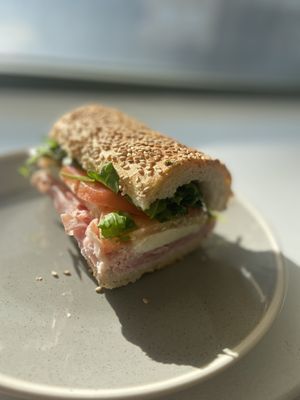
You are a GUI agent. You are given a task and a screenshot of the screen. Output one action in this format:
    pyautogui.click(x=<x>, y=<y>)
    Task: Click on the white speckled plate
    The width and height of the screenshot is (300, 400).
    Given the screenshot: What is the action you would take?
    pyautogui.click(x=40, y=296)